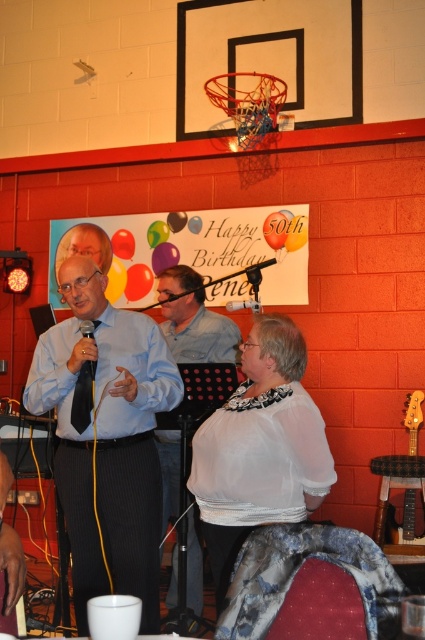
Question: Which object is farther from the camera taking this photo?

Choices:
 (A) wooden stool at lower right
 (B) black silk tie at center

Answer: (A)

Question: Can you confirm if rubber balloon at upper left is positioned below matte yellow balloon at center?

Choices:
 (A) yes
 (B) no

Answer: (A)

Question: Estimate the real-world distances between objects in this image. Which object is closer to the matte yellow balloon at center?

Choices:
 (A) multicolored glossy balloon at upper center
 (B) white sheer blouse at center
 (C) shiny metallic balloon at upper center

Answer: (C)

Question: Does rubber balloon at upper left have a greater width compared to multicolored glossy balloon at upper center?

Choices:
 (A) no
 (B) yes

Answer: (B)

Question: Which of the following is the farthest from the observer?

Choices:
 (A) (176, 220)
 (B) (138, 298)

Answer: (B)

Question: Can you confirm if light blue shirt at center is positioned to the right of multicolored latex balloon at center?

Choices:
 (A) yes
 (B) no

Answer: (B)